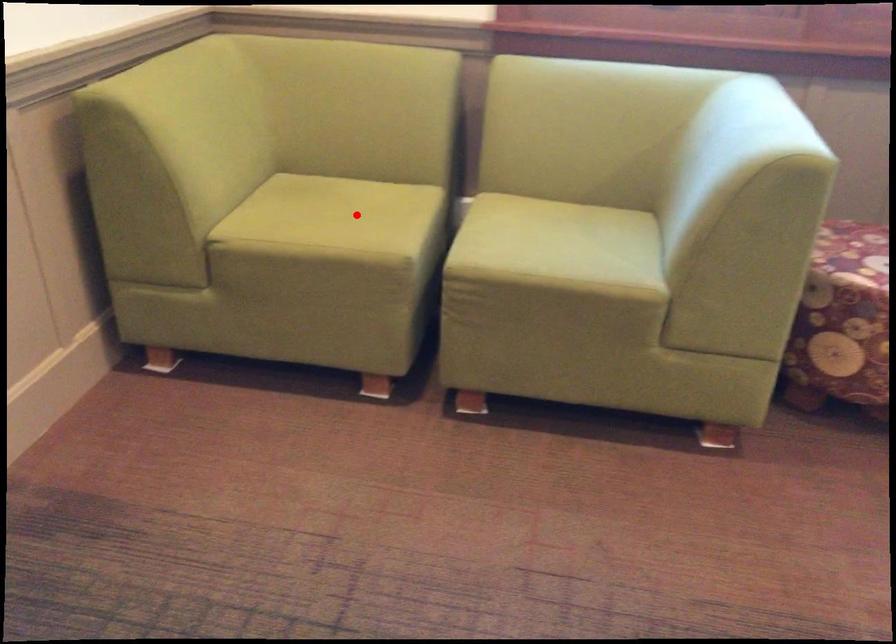
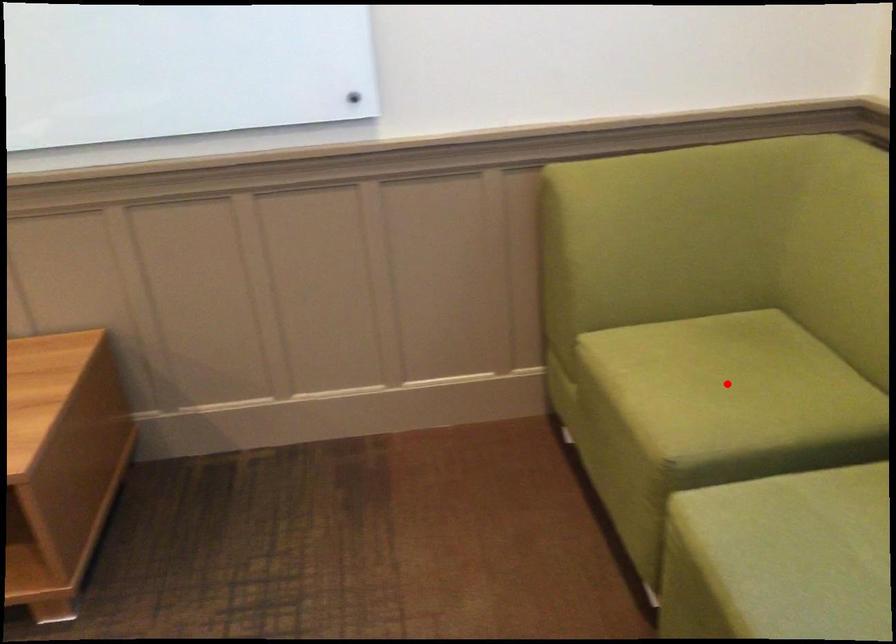
I am providing you with two images of the same scene from different viewpoints. A red point is marked on the first image and another point is marked on the second image. Does the point marked in image1 correspond to the same location as the one in image2?

Yes